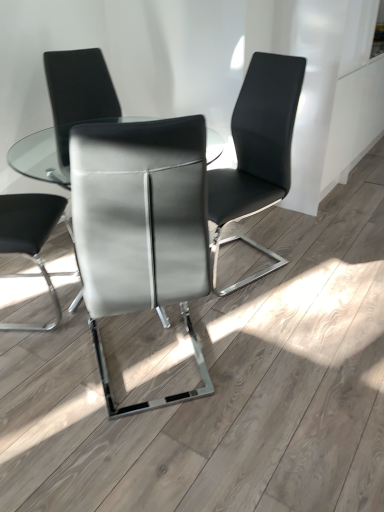
This screenshot has width=384, height=512. In order to click on free space to the left of satin gray leather chair at center, placed as the 2th chair when sorted from left to right in this screenshot , I will do `click(46, 371)`.